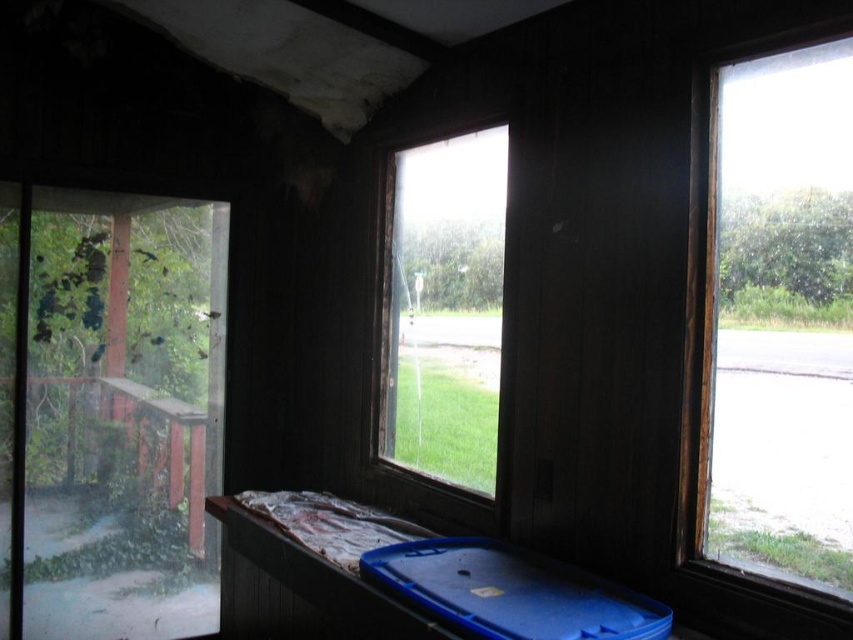
Can you confirm if clear glass window at center is thinner than blue plastic tray at lower center?

Yes.

Does clear glass window at center lie in front of blue plastic tray at lower center?

No, clear glass window at center is further to the viewer.

Who is more forward, (476, 241) or (421, 557)?

Positioned in front is point (421, 557).

The image size is (853, 640). In order to click on clear glass window at center in this screenshot , I will do `click(445, 308)`.

Who is taller, clear glass window at right or blue plastic tray at lower center?

Standing taller between the two is clear glass window at right.

Does clear glass window at right appear over blue plastic tray at lower center?

Indeed, clear glass window at right is positioned over blue plastic tray at lower center.

This screenshot has height=640, width=853. Identify the location of clear glass window at right. (779, 320).

You are a GUI agent. You are given a task and a screenshot of the screen. Output one action in this format:
    pyautogui.click(x=<x>, y=<y>)
    Task: Click on the clear glass window at right
    The height and width of the screenshot is (640, 853).
    Given the screenshot: What is the action you would take?
    pyautogui.click(x=779, y=320)

Image resolution: width=853 pixels, height=640 pixels. I want to click on clear glass window at right, so click(779, 320).

This screenshot has height=640, width=853. Describe the element at coordinates (779, 320) in the screenshot. I see `clear glass window at right` at that location.

This screenshot has width=853, height=640. In order to click on clear glass window at right in this screenshot , I will do `click(779, 320)`.